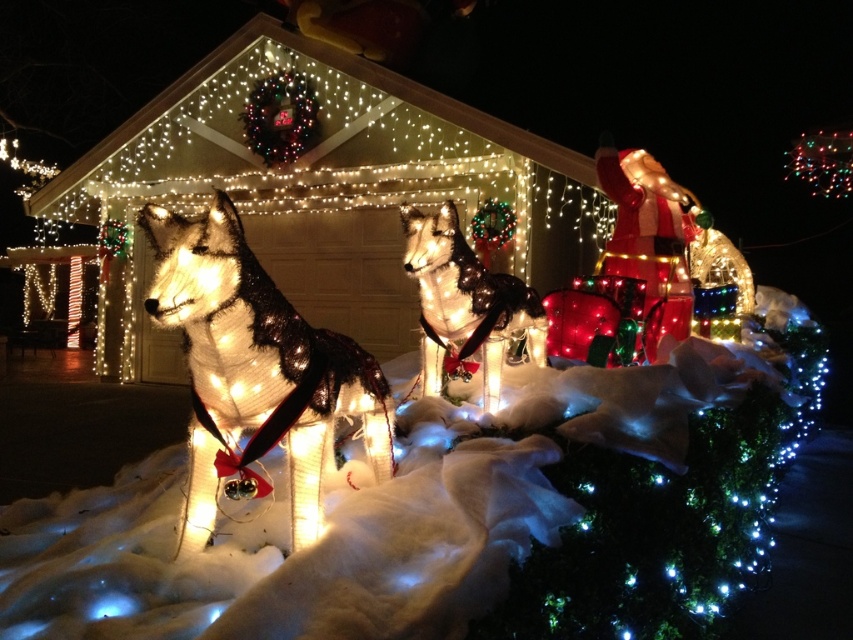
From the picture: You are a delivery person trying to place a small package on the icy white snow at lower left and the illuminated mesh dog at center. Which surface can accommodate the package without it falling over?

The icy white snow at lower left is larger in size than the illuminated mesh dog at center, so the package can be placed on the icy white snow at lower left as it has a bigger surface area to support the package without it falling over.

You are a delivery person trying to find the front door of the house. You see the icy white snow at lower left and the illuminated mesh dog at center. According to the scene description, which object is closer to the front door?

The illuminated mesh dog at center is closer to the front door since the icy white snow at lower left is to the right of it, implying the dog is positioned in front of the door area.